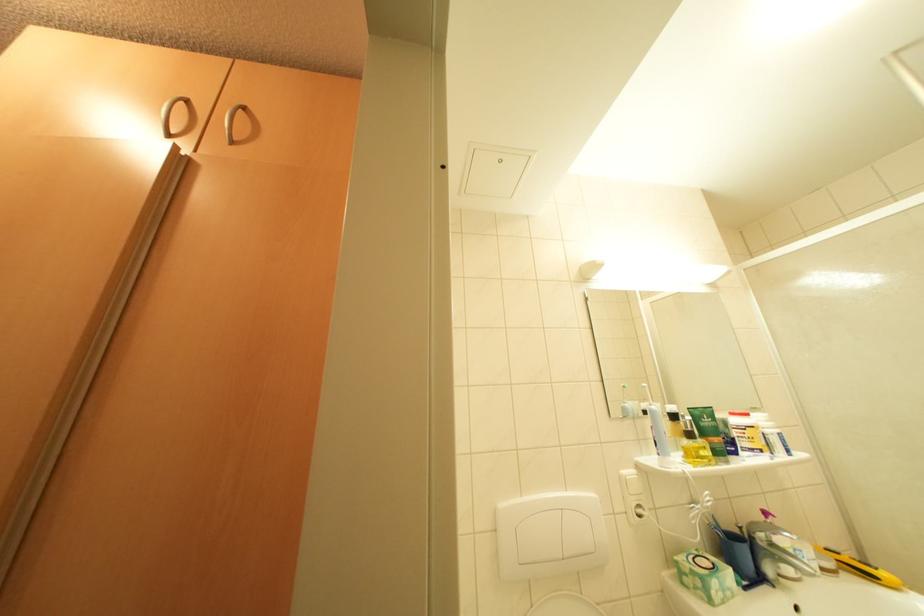
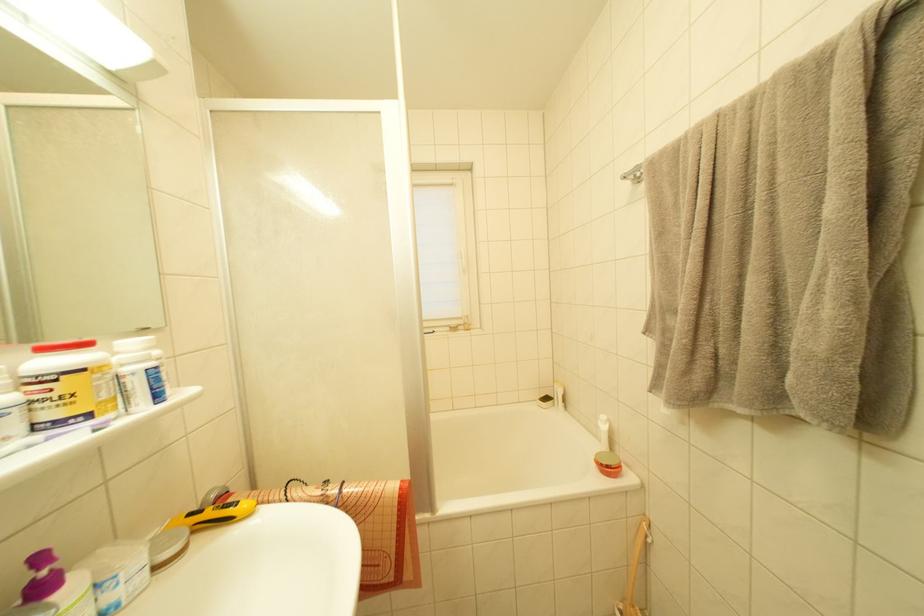
Find the pixel in the second image that matches the point at 752,419 in the first image.

(91, 349)